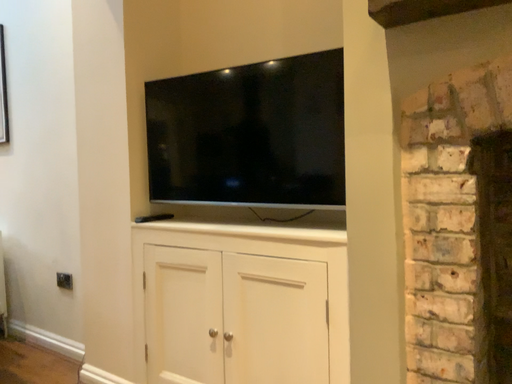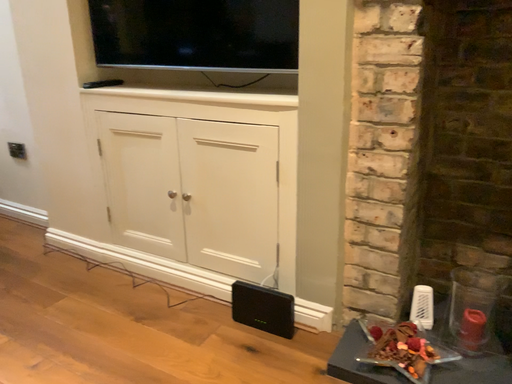
Question: How did the camera likely rotate when shooting the video?

Choices:
 (A) rotated downward
 (B) rotated upward

Answer: (A)